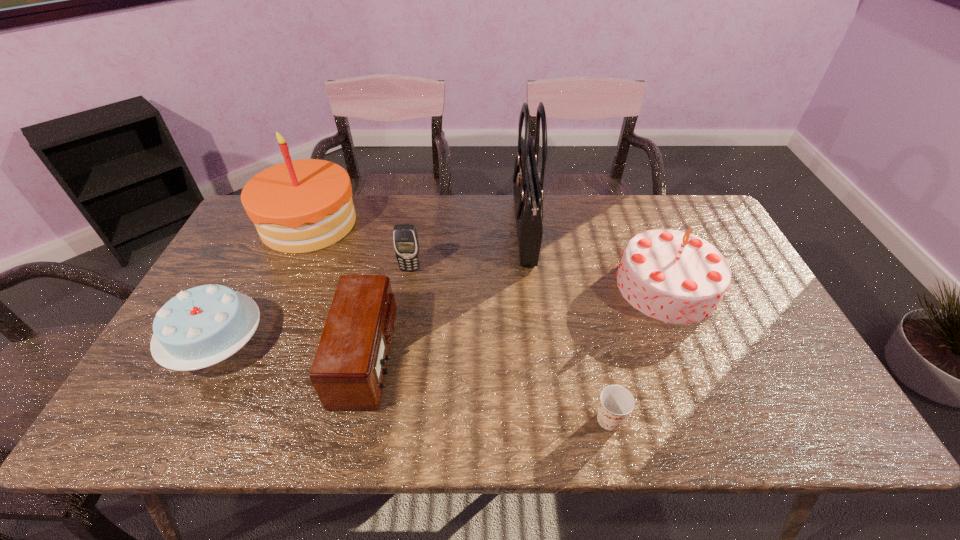
This screenshot has height=540, width=960. I want to click on the tallest object, so click(x=528, y=194).

The height and width of the screenshot is (540, 960). In order to click on the fifth object from left to right in this screenshot , I will do `click(528, 194)`.

You are a GUI agent. You are given a task and a screenshot of the screen. Output one action in this format:
    pyautogui.click(x=<x>, y=<y>)
    Task: Click on the tallest birthday cake
    The image size is (960, 540).
    Given the screenshot: What is the action you would take?
    pyautogui.click(x=299, y=206)

This screenshot has width=960, height=540. Identify the location of the third tallest object. point(676,277).

Where is `the rightmost object`? Image resolution: width=960 pixels, height=540 pixels. the rightmost object is located at coordinates (676, 277).

You are a GUI agent. You are given a task and a screenshot of the screen. Output one action in this format:
    pyautogui.click(x=<x>, y=<y>)
    Task: Click on the cellular telephone
    The width and height of the screenshot is (960, 540).
    Given the screenshot: What is the action you would take?
    pyautogui.click(x=406, y=244)

Find the location of a particular element. The height and width of the screenshot is (540, 960). the shortest birthday cake is located at coordinates (202, 326).

You are a GUI agent. You are given a task and a screenshot of the screen. Output one action in this format:
    pyautogui.click(x=<x>, y=<y>)
    Task: Click on the radio receiver
    The width and height of the screenshot is (960, 540).
    Given the screenshot: What is the action you would take?
    pyautogui.click(x=348, y=371)

Where is `the sixth object from left to right`? the sixth object from left to right is located at coordinates (616, 402).

Locate an element on the screen. Dixie cup is located at coordinates (616, 402).